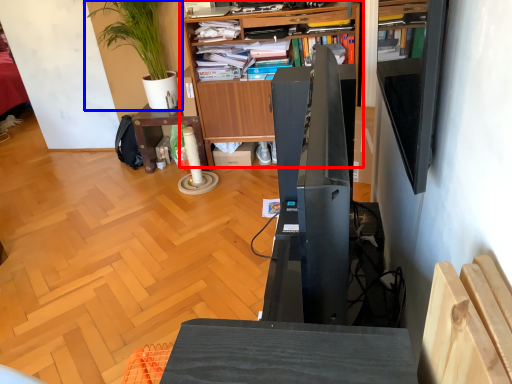
Question: Which object appears closest to the camera in this image, bookcase (highlighted by a red box) or houseplant (highlighted by a blue box)?

Choices:
 (A) bookcase
 (B) houseplant

Answer: (A)